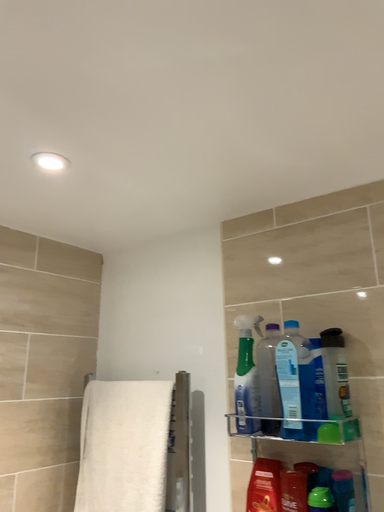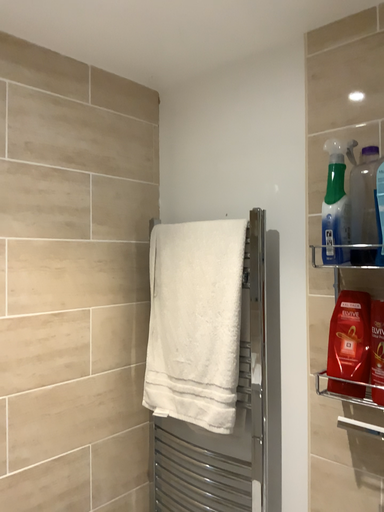
Question: Which way did the camera rotate in the video?

Choices:
 (A) rotated upward
 (B) rotated downward

Answer: (B)